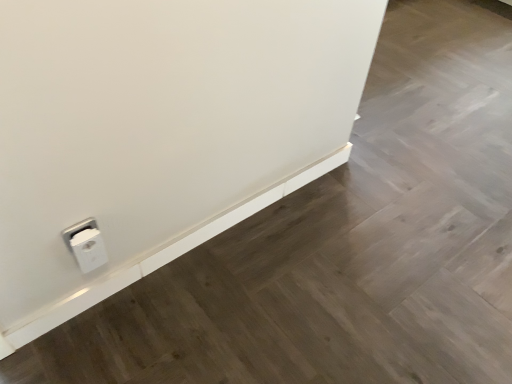
Question: Is white plastic power plug at lower left far from white plastic ledge at lower left?

Choices:
 (A) yes
 (B) no

Answer: (B)

Question: Considering the relative sizes of white plastic power plug at lower left and white plastic ledge at lower left in the image provided, is white plastic power plug at lower left wider than white plastic ledge at lower left?

Choices:
 (A) yes
 (B) no

Answer: (A)

Question: Is white plastic power plug at lower left at the right side of white plastic ledge at lower left?

Choices:
 (A) no
 (B) yes

Answer: (A)

Question: From the image's perspective, is white plastic power plug at lower left on white plastic ledge at lower left?

Choices:
 (A) yes
 (B) no

Answer: (B)

Question: Can you confirm if white plastic power plug at lower left is bigger than white plastic ledge at lower left?

Choices:
 (A) yes
 (B) no

Answer: (B)

Question: Can you confirm if white plastic power plug at lower left is taller than white plastic ledge at lower left?

Choices:
 (A) yes
 (B) no

Answer: (A)

Question: From the image's perspective, is white plastic ledge at lower left located above white plastic power plug at lower left?

Choices:
 (A) yes
 (B) no

Answer: (A)

Question: Considering the relative positions of white plastic ledge at lower left and white plastic power plug at lower left in the image provided, is white plastic ledge at lower left to the left of white plastic power plug at lower left from the viewer's perspective?

Choices:
 (A) yes
 (B) no

Answer: (B)

Question: From the image's perspective, does white plastic ledge at lower left appear lower than white plastic power plug at lower left?

Choices:
 (A) yes
 (B) no

Answer: (B)

Question: Is the depth of white plastic ledge at lower left less than that of white plastic power plug at lower left?

Choices:
 (A) yes
 (B) no

Answer: (B)

Question: Is white plastic ledge at lower left outside white plastic power plug at lower left?

Choices:
 (A) no
 (B) yes

Answer: (B)

Question: Considering the relative sizes of white plastic ledge at lower left and white plastic power plug at lower left in the image provided, is white plastic ledge at lower left bigger than white plastic power plug at lower left?

Choices:
 (A) no
 (B) yes

Answer: (B)

Question: From a real-world perspective, is white plastic ledge at lower left physically located above or below white plastic power plug at lower left?

Choices:
 (A) below
 (B) above

Answer: (A)